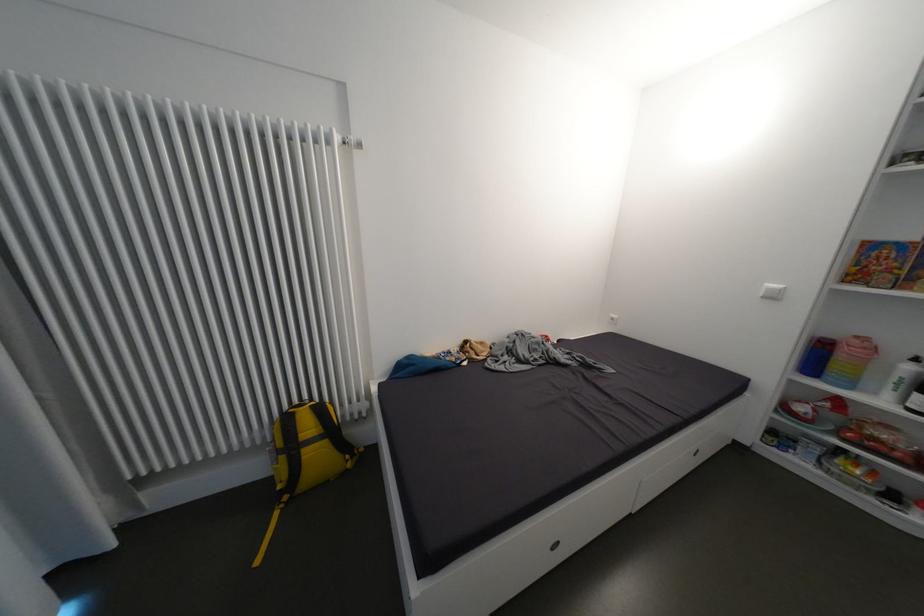
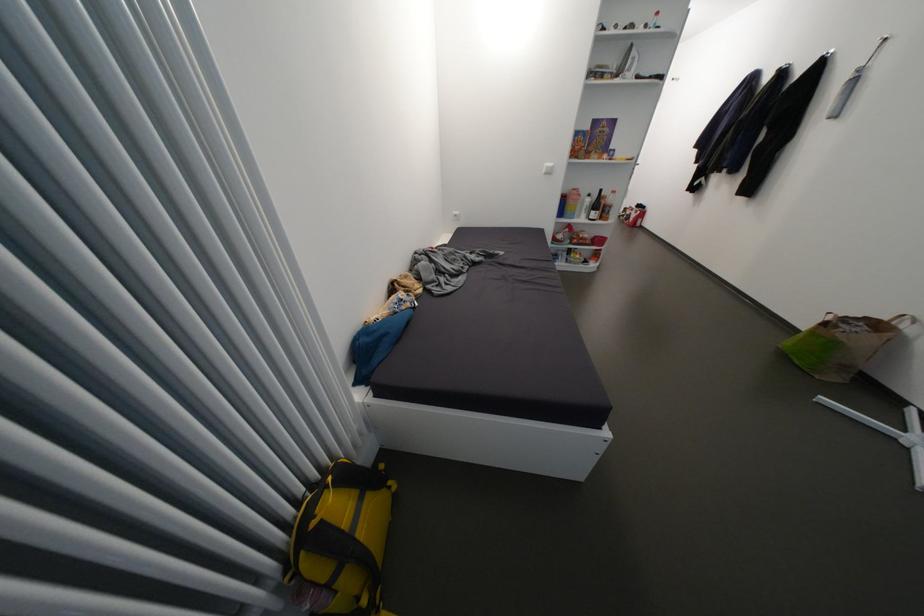
The first image is from the beginning of the video and the second image is from the end. How did the camera likely rotate when shooting the video?

The camera rotated toward right-down.